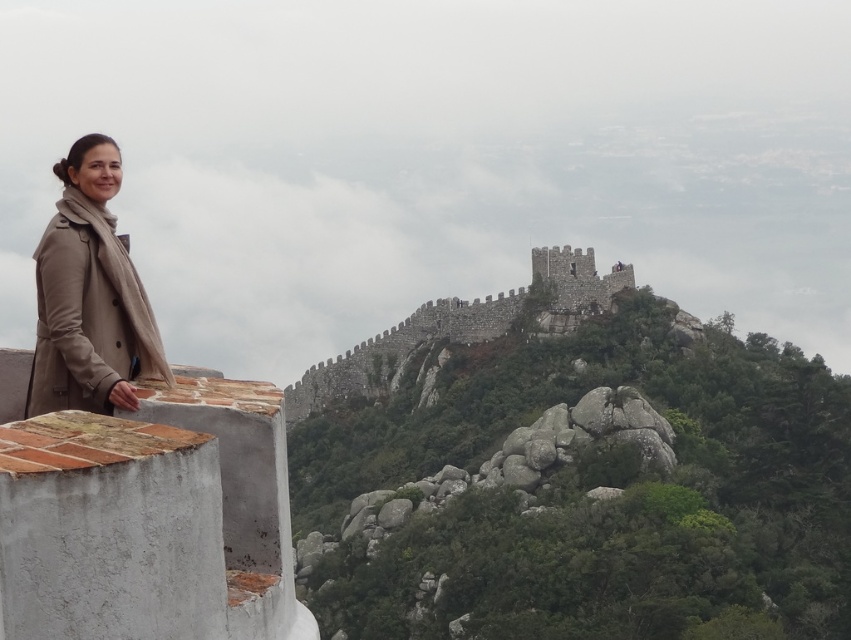
Question: Among these objects, which one is farthest from the camera?

Choices:
 (A) stone wall at upper center
 (B) beige coat at left

Answer: (A)

Question: Is beige coat at left below stone wall at upper center?

Choices:
 (A) yes
 (B) no

Answer: (B)

Question: From the image, what is the correct spatial relationship of beige coat at left in relation to stone wall at upper center?

Choices:
 (A) above
 (B) below

Answer: (A)

Question: Which of the following is the closest to the observer?

Choices:
 (A) beige coat at left
 (B) stone wall at upper center

Answer: (A)

Question: Is the position of beige coat at left more distant than that of stone wall at upper center?

Choices:
 (A) no
 (B) yes

Answer: (A)